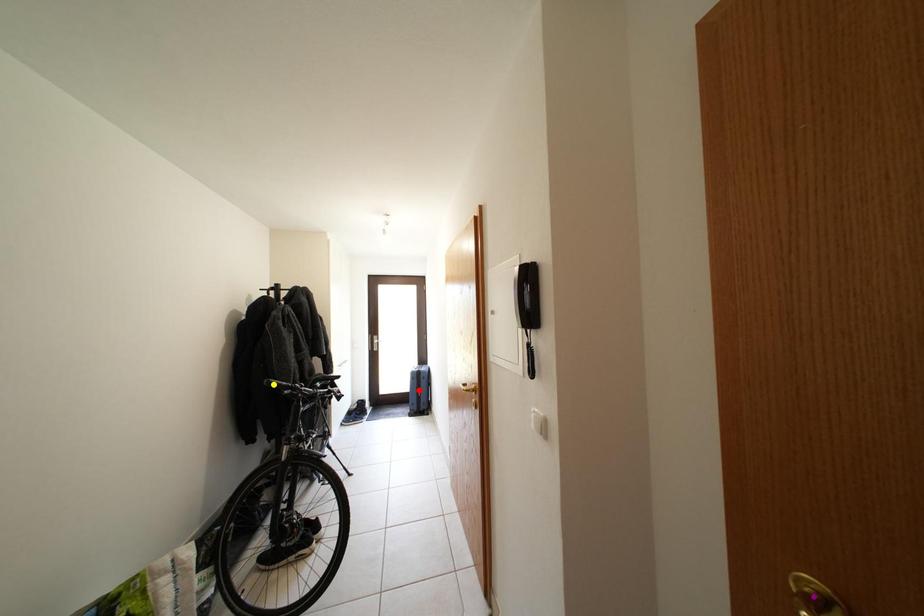
Order these from nearest to farthest:
A) yellow point
B) red point
C) purple point

red point < yellow point < purple point